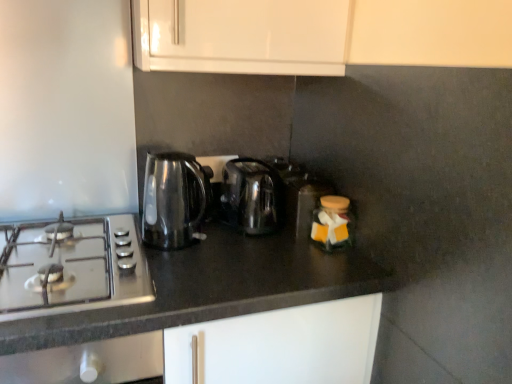
Find the location of a particular element. Image resolution: width=512 pixels, height=384 pixels. satin silver gas stove at left is located at coordinates (71, 267).

Considering the positions of points (240, 206) and (157, 187), is point (240, 206) closer to camera compared to point (157, 187)?

No, (240, 206) is further to viewer.

Considering the sizes of stainless steel kettle at center, which is the second kitchen appliance from left to right, and transparent glass kettle at left, which ranks as the 2th kitchen appliance in right-to-left order, in the image, is stainless steel kettle at center, which is the second kitchen appliance from left to right, wider or thinner than transparent glass kettle at left, which ranks as the 2th kitchen appliance in right-to-left order,?

Clearly, stainless steel kettle at center, which is the second kitchen appliance from left to right, has more width compared to transparent glass kettle at left, which ranks as the 2th kitchen appliance in right-to-left order.

Based on the photo, does stainless steel kettle at center, which is the second kitchen appliance from left to right, appear on the left side of transparent glass kettle at left, acting as the 1th kitchen appliance starting from the left?

No, stainless steel kettle at center, which is the second kitchen appliance from left to right, is not to the left of transparent glass kettle at left, acting as the 1th kitchen appliance starting from the left.

From the picture: Could you tell me if stainless steel kettle at center, the 1th kitchen appliance viewed from the right, is turned towards transparent glass kettle at left, which ranks as the 2th kitchen appliance in right-to-left order?

No, stainless steel kettle at center, the 1th kitchen appliance viewed from the right, is not facing towards transparent glass kettle at left, which ranks as the 2th kitchen appliance in right-to-left order.

In the scene shown: Is transparent glass kettle at left, acting as the 1th kitchen appliance starting from the left, wider or thinner than satin silver gas stove at left?

Considering their sizes, transparent glass kettle at left, acting as the 1th kitchen appliance starting from the left, looks slimmer than satin silver gas stove at left.

Does transparent glass kettle at left, acting as the 1th kitchen appliance starting from the left, have a smaller size compared to satin silver gas stove at left?

Indeed, transparent glass kettle at left, acting as the 1th kitchen appliance starting from the left, has a smaller size compared to satin silver gas stove at left.

From the image's perspective, which is above, transparent glass kettle at left, acting as the 1th kitchen appliance starting from the left, or satin silver gas stove at left?

transparent glass kettle at left, acting as the 1th kitchen appliance starting from the left, from the image's perspective.

Is satin silver gas stove at left at the back of transparent glass kettle at left, acting as the 1th kitchen appliance starting from the left?

No, satin silver gas stove at left is not at the back of transparent glass kettle at left, acting as the 1th kitchen appliance starting from the left.

In the scene shown: From a real-world perspective, is stainless steel kettle at center, which is the second kitchen appliance from left to right, on black granite countertop at center?

Yes, from a real-world perspective, stainless steel kettle at center, which is the second kitchen appliance from left to right, is above black granite countertop at center.

Can you confirm if stainless steel kettle at center, the 1th kitchen appliance viewed from the right, is bigger than black granite countertop at center?

No.

Which object is closer to the camera, stainless steel kettle at center, the 1th kitchen appliance viewed from the right, or black granite countertop at center?

black granite countertop at center.

How different are the orientations of stainless steel kettle at center, the 1th kitchen appliance viewed from the right, and black granite countertop at center in degrees?

The angle between the facing direction of stainless steel kettle at center, the 1th kitchen appliance viewed from the right, and the facing direction of black granite countertop at center is 0.848 degrees.

Does point (79, 240) lie in front of point (188, 190)?

No, (79, 240) is behind (188, 190).

From a real-world perspective, between satin silver gas stove at left and transparent glass kettle at left, which ranks as the 2th kitchen appliance in right-to-left order, who is vertically higher?

From a 3D spatial view, transparent glass kettle at left, which ranks as the 2th kitchen appliance in right-to-left order, is above.

Which object is further away from the camera taking this photo, satin silver gas stove at left or transparent glass kettle at left, which ranks as the 2th kitchen appliance in right-to-left order?

transparent glass kettle at left, which ranks as the 2th kitchen appliance in right-to-left order, is further from the camera.

Is transparent glass kettle at left, acting as the 1th kitchen appliance starting from the left, at the back of satin silver gas stove at left?

No.

Looking at this image, can you confirm if black granite countertop at center is thinner than satin silver gas stove at left?

No.

Can you see black granite countertop at center touching satin silver gas stove at left?

No, black granite countertop at center is not touching satin silver gas stove at left.

Can you confirm if black granite countertop at center is positioned to the left of satin silver gas stove at left?

No.

From the image's perspective, is black granite countertop at center below satin silver gas stove at left?

Yes, from the image's perspective, black granite countertop at center is below satin silver gas stove at left.

From a real-world perspective, is black granite countertop at center located higher than translucent plastic container at center, positioned as the first appliance in back-to-front order?

Actually, black granite countertop at center is physically below translucent plastic container at center, positioned as the first appliance in back-to-front order, in the real world.

Does black granite countertop at center lie in front of translucent plastic container at center, positioned as the first appliance in back-to-front order?

Yes, it is in front of translucent plastic container at center, positioned as the first appliance in back-to-front order.

Identify the location of countertop below the translucent plastic container at center, positioned as the first appliance in back-to-front order (from the image's perspective). The width and height of the screenshot is (512, 384). (212, 288).

Based on the photo, how many degrees apart are the facing directions of black granite countertop at center and translucent plastic container at center, positioned as the first appliance in back-to-front order?

0.847 degrees.

From a real-world perspective, which is physically above, transparent glass kettle at left, acting as the 1th kitchen appliance starting from the left, or black granite countertop at center?

transparent glass kettle at left, acting as the 1th kitchen appliance starting from the left, is physically above.

Is transparent glass kettle at left, which ranks as the 2th kitchen appliance in right-to-left order, spatially inside black granite countertop at center, or outside of it?

transparent glass kettle at left, which ranks as the 2th kitchen appliance in right-to-left order, is not inside black granite countertop at center, it's outside.

Who is smaller, transparent glass kettle at left, acting as the 1th kitchen appliance starting from the left, or black granite countertop at center?

With smaller size is transparent glass kettle at left, acting as the 1th kitchen appliance starting from the left.

In the scene shown: Is transparent glass kettle at left, which ranks as the 2th kitchen appliance in right-to-left order, wider or thinner than black granite countertop at center?

transparent glass kettle at left, which ranks as the 2th kitchen appliance in right-to-left order, is thinner than black granite countertop at center.

Locate an element on the screen. The width and height of the screenshot is (512, 384). kitchen appliance in front of the stainless steel kettle at center, which is the second kitchen appliance from left to right is located at coordinates (174, 200).

Where is `gas stove located underneath the transparent glass kettle at left, which ranks as the 2th kitchen appliance in right-to-left order (from a real-world perspective)`? gas stove located underneath the transparent glass kettle at left, which ranks as the 2th kitchen appliance in right-to-left order (from a real-world perspective) is located at coordinates (71, 267).

Estimate the real-world distances between objects in this image. Which object is further from satin silver gas stove at left, stainless steel kettle at center, which is the second kitchen appliance from left to right, or transparent glass kettle at left, acting as the 1th kitchen appliance starting from the left?

Among the two, stainless steel kettle at center, which is the second kitchen appliance from left to right, is located further to satin silver gas stove at left.

Considering their positions, is satin silver gas stove at left positioned closer to matte glass jar at center right, which is counted as the 2th appliance, starting from the back, than translucent plastic container at center, positioned as the first appliance in back-to-front order?

translucent plastic container at center, positioned as the first appliance in back-to-front order.

When comparing their distances from translucent plastic container at center, arranged as the second appliance when viewed from the front, does satin silver gas stove at left or matte glass jar at center right, which is counted as the 2th appliance, starting from the back, seem closer?

matte glass jar at center right, which is counted as the 2th appliance, starting from the back, is closer to translucent plastic container at center, arranged as the second appliance when viewed from the front.

Looking at this image, which object lies further to the anchor point satin silver gas stove at left, translucent plastic container at center, arranged as the second appliance when viewed from the front, or black granite countertop at center?

translucent plastic container at center, arranged as the second appliance when viewed from the front, lies further to satin silver gas stove at left than the other object.

Considering their positions, is translucent plastic container at center, arranged as the second appliance when viewed from the front, positioned further to black granite countertop at center than transparent glass kettle at left, which ranks as the 2th kitchen appliance in right-to-left order?

translucent plastic container at center, arranged as the second appliance when viewed from the front, lies further to black granite countertop at center than the other object.

Which object lies nearer to the anchor point transparent glass kettle at left, which ranks as the 2th kitchen appliance in right-to-left order, stainless steel kettle at center, the 1th kitchen appliance viewed from the right, or matte glass jar at center right, marked as the 1th appliance in a front-to-back arrangement?

The object closer to transparent glass kettle at left, which ranks as the 2th kitchen appliance in right-to-left order, is stainless steel kettle at center, the 1th kitchen appliance viewed from the right.

From the image, which object appears to be nearer to stainless steel kettle at center, the 1th kitchen appliance viewed from the right, satin silver gas stove at left or translucent plastic container at center, positioned as the first appliance in back-to-front order?

translucent plastic container at center, positioned as the first appliance in back-to-front order, lies closer to stainless steel kettle at center, the 1th kitchen appliance viewed from the right, than the other object.

From the image, which object appears to be farther from translucent plastic container at center, arranged as the second appliance when viewed from the front, satin silver gas stove at left or black granite countertop at center?

Based on the image, satin silver gas stove at left appears to be further to translucent plastic container at center, arranged as the second appliance when viewed from the front.

Where is `kitchen appliance situated between transparent glass kettle at left, acting as the 1th kitchen appliance starting from the left, and matte glass jar at center right, which is counted as the 2th appliance, starting from the back, from left to right`? The width and height of the screenshot is (512, 384). kitchen appliance situated between transparent glass kettle at left, acting as the 1th kitchen appliance starting from the left, and matte glass jar at center right, which is counted as the 2th appliance, starting from the back, from left to right is located at coordinates (251, 196).

Where is `appliance between satin silver gas stove at left and matte glass jar at center right, marked as the 1th appliance in a front-to-back arrangement, in the horizontal direction`? This screenshot has width=512, height=384. appliance between satin silver gas stove at left and matte glass jar at center right, marked as the 1th appliance in a front-to-back arrangement, in the horizontal direction is located at coordinates (303, 199).

Locate an element on the screen. gas stove between transparent glass kettle at left, acting as the 1th kitchen appliance starting from the left, and black granite countertop at center from top to bottom is located at coordinates (71, 267).

Identify the location of appliance that lies between translucent plastic container at center, positioned as the first appliance in back-to-front order, and black granite countertop at center from top to bottom. (332, 222).